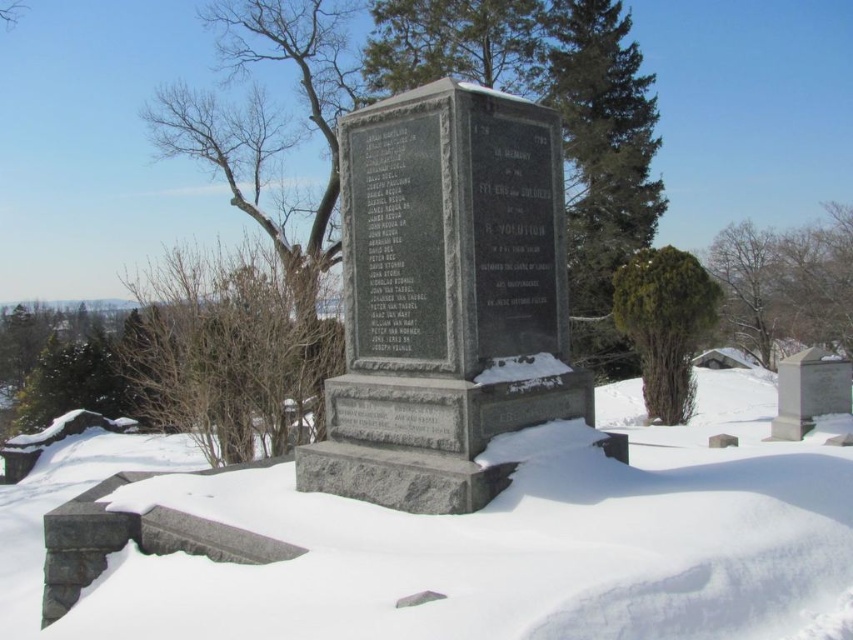
You are standing in a winter cemetery and see the granite stone monument at center. If you want to take a closer look, how many steps do you need to take to reach it if each step covers 0.7 meters?

The granite stone monument at center is 3.36 meters away. Since each step covers 0.7 meters, dividing 3.36 by 0.7 gives exactly 4.8 steps. Since you can take partial steps, you would need to take approximately 5 steps to reach the granite stone monument at center.

You are a photographer wanting to capture the white powdery snow at center and the green textured evergreen tree at upper right in a single frame. Will the snow be visible beneath the tree in your photo?

The white powdery snow at center is positioned under the green textured evergreen tree at upper right, so yes, the snow will be visible beneath the tree in the photo.

You are a photographer wanting to capture both the granite stone monument at center and the green textured bush at right in a single frame. Based on their heights, which object will appear larger in the photo?

The granite stone monument at center appears larger in the photo because it has a greater height compared to the green textured bush at right.